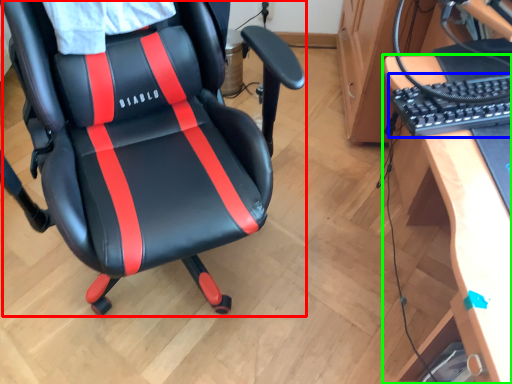
Question: Estimate the real-world distances between objects in this image. Which object is farther from chair (highlighted by a red box), computer keyboard (highlighted by a blue box) or desk (highlighted by a green box)?

Choices:
 (A) computer keyboard
 (B) desk

Answer: (B)